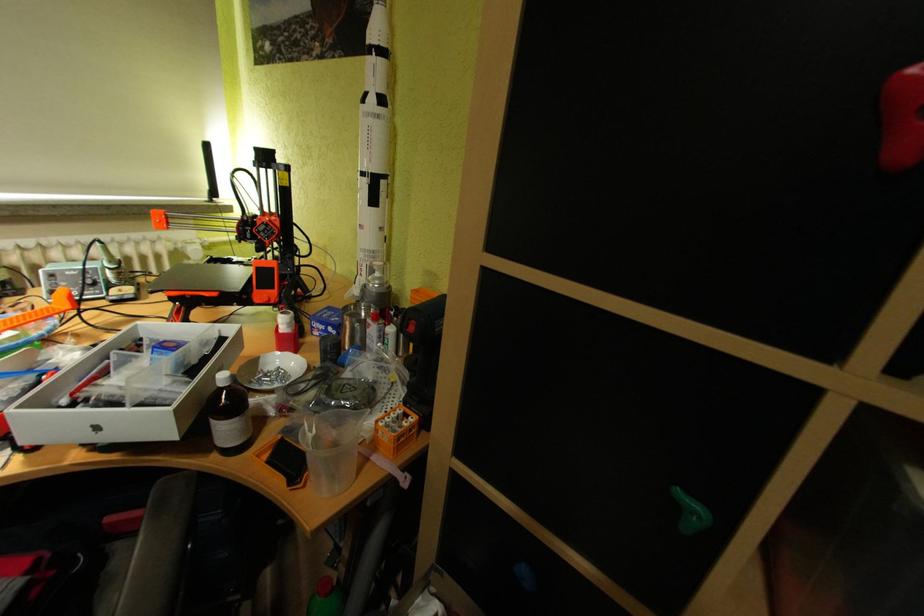
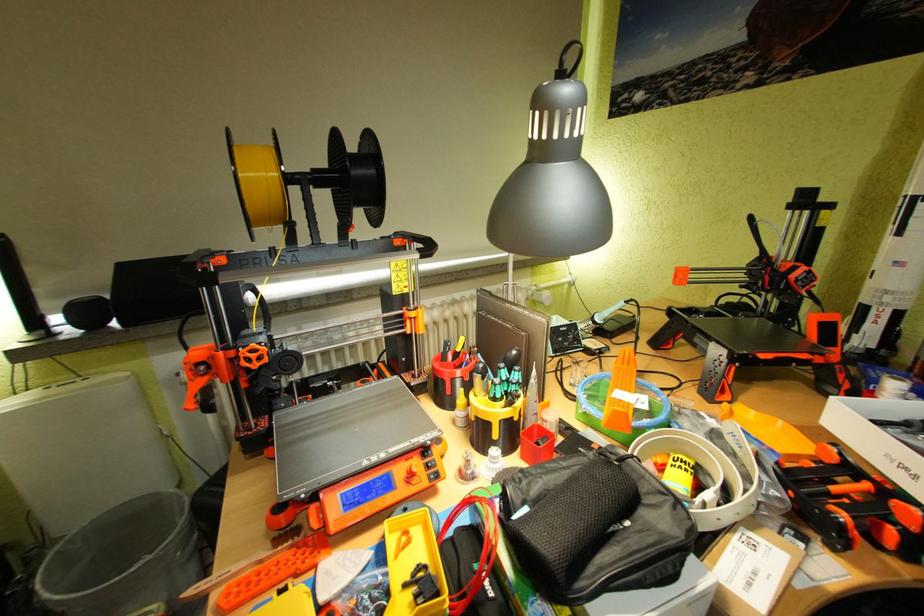
Question: In a continuous first-person perspective shot, in which direction is the camera moving?

Choices:
 (A) Left
 (B) Right
 (C) Forward
 (D) Backward

Answer: (A)